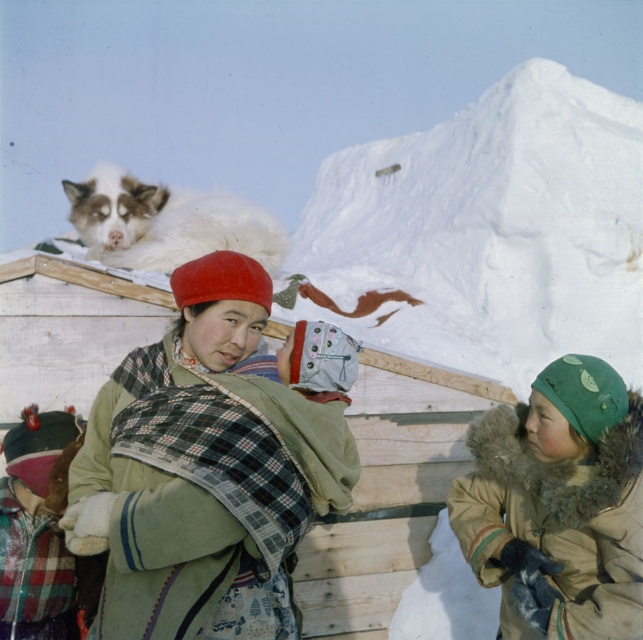
Question: Considering the real-world distances, which object is farthest from the green woolen scarf at center?

Choices:
 (A) green fur-lined coat at lower right
 (B) plaid fabric baby carrier at center

Answer: (A)

Question: Does green fur-lined coat at lower right come behind white fluffy cat at upper left?

Choices:
 (A) yes
 (B) no

Answer: (B)

Question: Among these points, which one is farthest from the camera?

Choices:
 (A) (294, 465)
 (B) (547, 579)

Answer: (B)

Question: Does green woolen scarf at center appear over plaid fabric baby carrier at center?

Choices:
 (A) yes
 (B) no

Answer: (A)

Question: In this image, where is green fur-lined coat at lower right located relative to white fluffy cat at upper left?

Choices:
 (A) right
 (B) left

Answer: (A)

Question: Which point is closer to the camera?

Choices:
 (A) click(x=521, y=461)
 (B) click(x=183, y=516)
 (C) click(x=257, y=212)

Answer: (B)